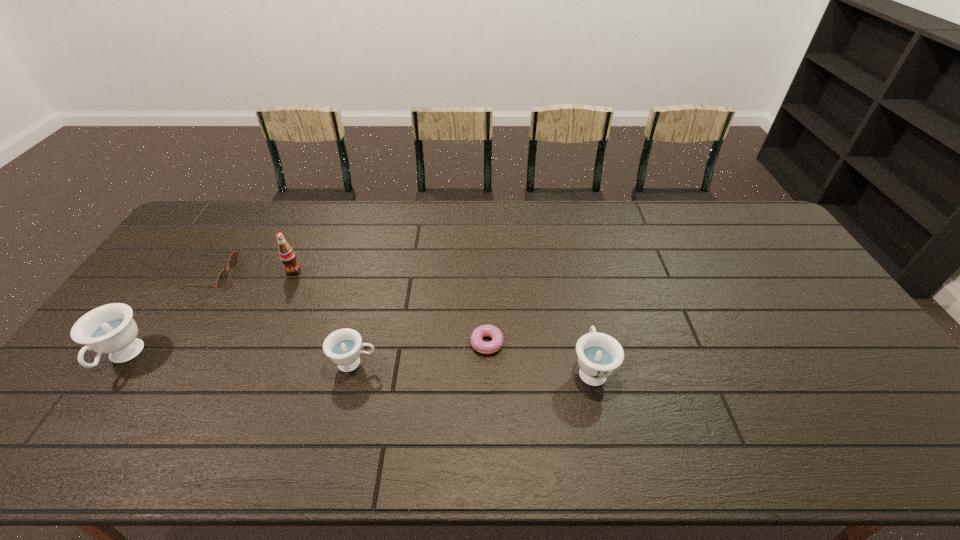
I want to click on free point that keeps the teacups evenly spaced on the right, so click(x=834, y=375).